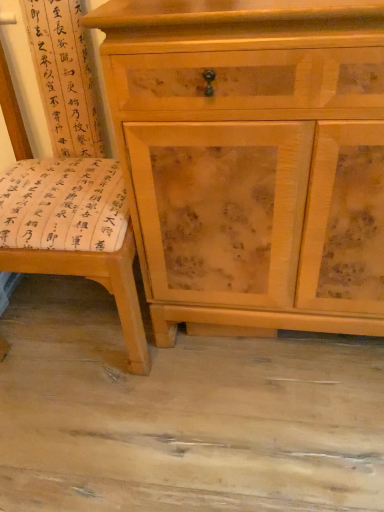
Where is `free point below wooden swivel chair at left (from a real-world perspective)`? free point below wooden swivel chair at left (from a real-world perspective) is located at coordinates (71, 326).